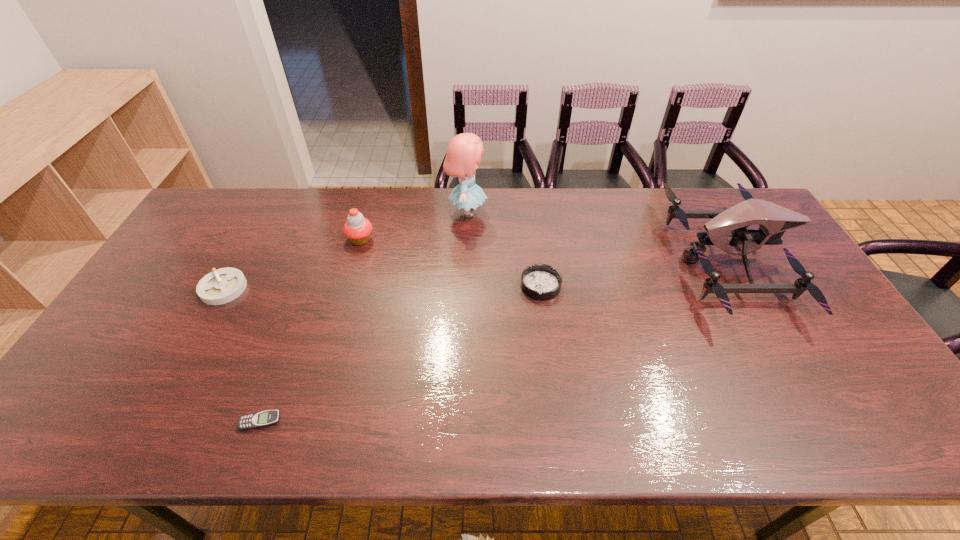
Find the location of `free location located on the front-facing side of the doll`. free location located on the front-facing side of the doll is located at coordinates (548, 212).

What are the coordinates of `vacant space located 0.130m on the front-facing side of the fifth shortest object` in the screenshot? It's located at (636, 260).

Where is `blank space located 0.050m on the front-facing side of the fifth shortest object`? This screenshot has width=960, height=540. blank space located 0.050m on the front-facing side of the fifth shortest object is located at coordinates [661, 260].

The width and height of the screenshot is (960, 540). What are the coordinates of `vacant space located 0.150m on the front-facing side of the fifth shortest object` in the screenshot? It's located at (629, 260).

Locate an element on the screen. free spot located 0.160m on the front of the third object from left to right is located at coordinates (348, 287).

Locate an element on the screen. This screenshot has width=960, height=540. vacant space located 0.120m on the left of the leftmost object is located at coordinates (160, 288).

Identify the location of vacant space situated 0.290m on the right of the right ashtray. (660, 286).

The image size is (960, 540). I want to click on vacant position located on the back of the fifth object from right to left, so click(x=284, y=356).

The width and height of the screenshot is (960, 540). What are the coordinates of `doll situated at the far edge` in the screenshot? It's located at (464, 151).

I want to click on drone located at the far edge, so pyautogui.click(x=774, y=220).